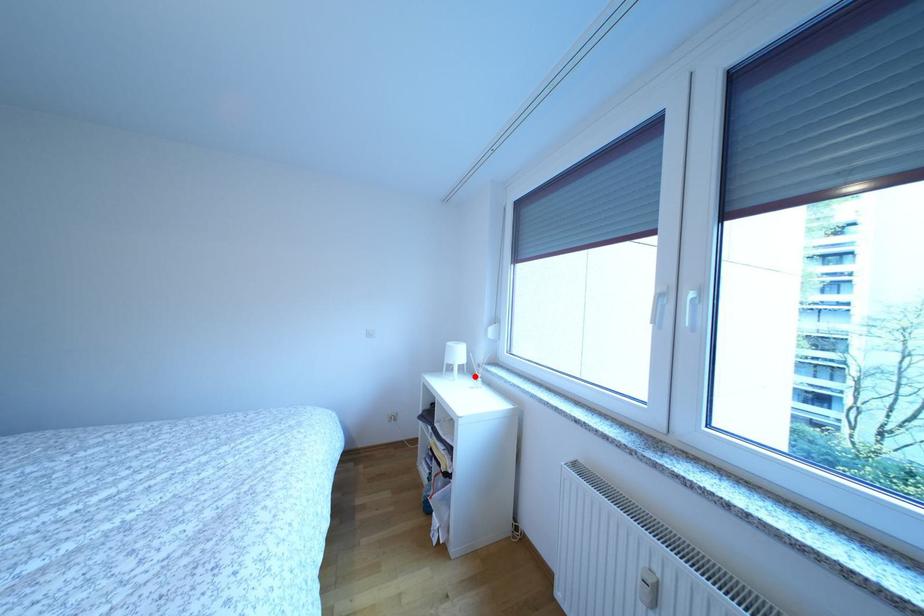
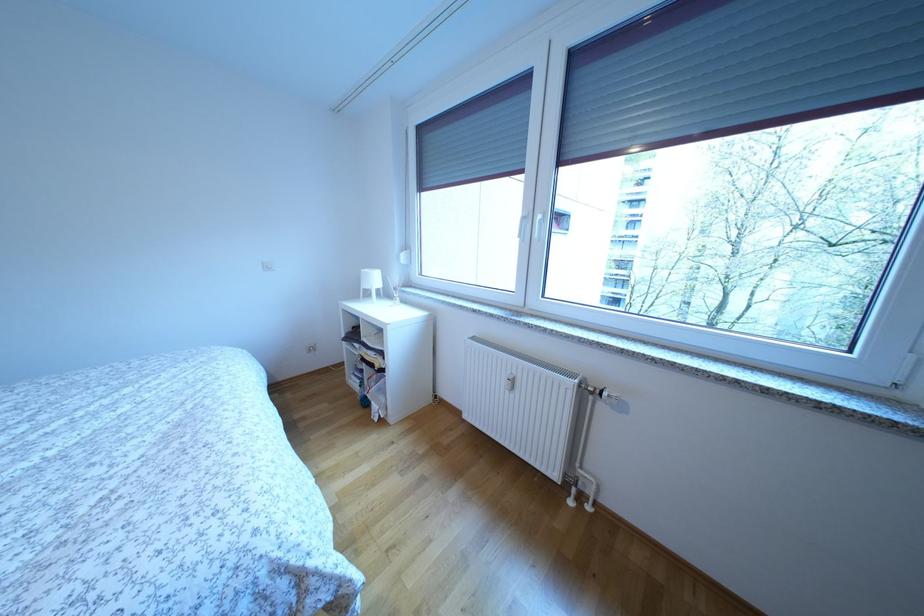
The point at the highlighted location is marked in the first image. Where is the corresponding point in the second image?

(392, 300)